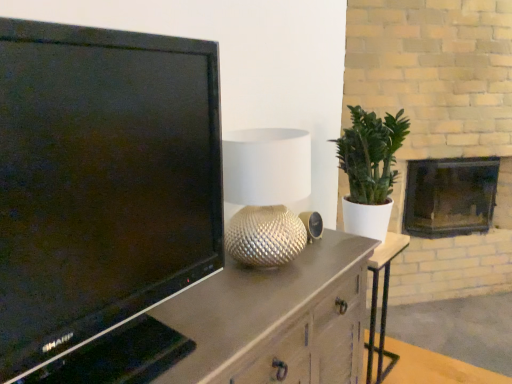
Where is `dark gray stone fireplace at right`? The image size is (512, 384). dark gray stone fireplace at right is located at coordinates (450, 196).

What do you see at coordinates (382, 303) in the screenshot?
I see `metallic silver side table at center` at bounding box center [382, 303].

I want to click on silver textured lamp at center, so click(x=266, y=194).

Locate an element on the screen. The height and width of the screenshot is (384, 512). dark gray stone fireplace at right is located at coordinates (450, 196).

Where is `lamp that is behind the black glossy television at left`? The image size is (512, 384). lamp that is behind the black glossy television at left is located at coordinates 266,194.

Considering the sizes of objects black glossy television at left and silver textured lamp at center in the image provided, who is thinner, black glossy television at left or silver textured lamp at center?

With smaller width is silver textured lamp at center.

From the image's perspective, is black glossy television at left located above or below silver textured lamp at center?

black glossy television at left is situated higher than silver textured lamp at center in the image.

Does black glossy television at left contain silver textured lamp at center?

No, silver textured lamp at center is not surrounded by black glossy television at left.

From a real-world perspective, between green matte plant at right and dark gray stone fireplace at right, who is vertically higher?

green matte plant at right is physically above.

How different are the orientations of green matte plant at right and dark gray stone fireplace at right in degrees?

green matte plant at right and dark gray stone fireplace at right are facing 39.9 degrees away from each other.

Based on the photo, considering the sizes of objects green matte plant at right and dark gray stone fireplace at right in the image provided, who is bigger, green matte plant at right or dark gray stone fireplace at right?

With larger size is dark gray stone fireplace at right.

Where is `houseplant above the dark gray stone fireplace at right (from a real-world perspective)`? This screenshot has height=384, width=512. houseplant above the dark gray stone fireplace at right (from a real-world perspective) is located at coordinates (370, 169).

Looking at this image, from a real-world perspective, between black glossy television at left and green matte plant at right, who is vertically higher?

black glossy television at left is physically above.

Would you say black glossy television at left is inside or outside green matte plant at right?

black glossy television at left lies outside green matte plant at right.

Consider the image. Are black glossy television at left and green matte plant at right far apart?

That's right, there is a large distance between black glossy television at left and green matte plant at right.

Relative to green matte plant at right, is black glossy television at left in front or behind?

Visually, black glossy television at left is located in front of green matte plant at right.

Where is `cabinetry located in front of the metallic silver side table at center`? The width and height of the screenshot is (512, 384). cabinetry located in front of the metallic silver side table at center is located at coordinates (276, 319).

Which is closer to the camera, (263,340) or (395,356)?

Point (263,340) is positioned closer to the camera compared to point (395,356).

From the picture: Is matte brown cabinet at left closer to camera compared to metallic silver side table at center?

Yes, the depth of matte brown cabinet at left is less than that of metallic silver side table at center.

Which is more to the right, silver textured lamp at center or black glossy television at left?

silver textured lamp at center.

How different are the orientations of silver textured lamp at center and black glossy television at left in degrees?

1.25 degrees.

From a real-world perspective, is silver textured lamp at center positioned above or below black glossy television at left?

silver textured lamp at center is below black glossy television at left.

Consider the image. Is silver textured lamp at center aimed at black glossy television at left?

No, silver textured lamp at center is not turned towards black glossy television at left.

Between metallic silver side table at center and matte brown cabinet at left, which one has less height?

With less height is metallic silver side table at center.

You are a GUI agent. You are given a task and a screenshot of the screen. Output one action in this format:
    pyautogui.click(x=<x>, y=<y>)
    Task: Click on the cabinetry above the metallic silver side table at center (from a real-world perspective)
    This screenshot has height=384, width=512.
    Given the screenshot: What is the action you would take?
    pyautogui.click(x=276, y=319)

From the image's perspective, who appears lower, metallic silver side table at center or matte brown cabinet at left?

matte brown cabinet at left, from the image's perspective.

Is silver textured lamp at center to the left or to the right of metallic silver side table at center in the image?

silver textured lamp at center is positioned on metallic silver side table at center's left side.

How many degrees apart are the facing directions of silver textured lamp at center and metallic silver side table at center?

They differ by 0.355 degrees in their facing directions.

Locate an element on the screen. The height and width of the screenshot is (384, 512). lamp in front of the metallic silver side table at center is located at coordinates (266, 194).

Is silver textured lamp at center inside the boundaries of metallic silver side table at center, or outside?

silver textured lamp at center lies outside metallic silver side table at center.

Where is `television located in front of the silver textured lamp at center`? television located in front of the silver textured lamp at center is located at coordinates point(101,181).

Identify the location of houseplant above the dark gray stone fireplace at right (from the image's perspective). This screenshot has width=512, height=384. (370, 169).

Based on their spatial positions, is silver textured lamp at center or black glossy television at left further from green matte plant at right?

Based on the image, black glossy television at left appears to be further to green matte plant at right.

Looking at the image, which one is located further to black glossy television at left, metallic silver side table at center or matte brown cabinet at left?

metallic silver side table at center.

Estimate the real-world distances between objects in this image. Which object is closer to silver textured lamp at center, matte brown cabinet at left or metallic silver side table at center?

matte brown cabinet at left is positioned closer to the anchor silver textured lamp at center.

Considering their positions, is matte brown cabinet at left positioned further to silver textured lamp at center than black glossy television at left?

The object further to silver textured lamp at center is black glossy television at left.

Estimate the real-world distances between objects in this image. Which object is closer to metallic silver side table at center, dark gray stone fireplace at right or matte brown cabinet at left?

dark gray stone fireplace at right.

Considering their positions, is metallic silver side table at center positioned further to silver textured lamp at center than green matte plant at right?

metallic silver side table at center lies further to silver textured lamp at center than the other object.

When comparing their distances from black glossy television at left, does dark gray stone fireplace at right or green matte plant at right seem closer?

green matte plant at right lies closer to black glossy television at left than the other object.

Consider the image. When comparing their distances from black glossy television at left, does green matte plant at right or silver textured lamp at center seem further?

green matte plant at right is positioned further to the anchor black glossy television at left.

Find the location of a particular element. cabinetry positioned between black glossy television at left and metallic silver side table at center from near to far is located at coordinates (276, 319).

Locate an element on the screen. table between green matte plant at right and dark gray stone fireplace at right in the front-back direction is located at coordinates coord(382,303).

Find the location of a particular element. The height and width of the screenshot is (384, 512). lamp located between matte brown cabinet at left and metallic silver side table at center in the depth direction is located at coordinates (266, 194).

Identify the location of lamp between green matte plant at right and metallic silver side table at center vertically. (266, 194).